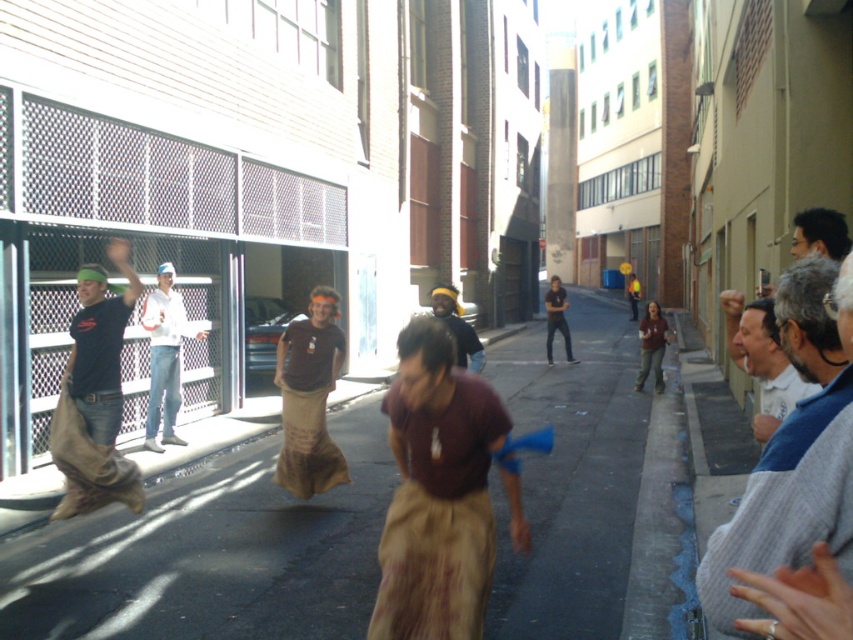
Measure the distance between white shirt at right and brown cotton shirt at center.

The distance of white shirt at right from brown cotton shirt at center is 34.60 feet.

Is point (807, 396) closer to viewer compared to point (659, 348)?

Yes, point (807, 396) is in front of point (659, 348).

Which is behind, point (743, 332) or point (635, 380)?

Point (635, 380)

This screenshot has height=640, width=853. Find the location of `white shirt at right`. white shirt at right is located at coordinates (762, 358).

Which is above, brown fabric sack at center or dark brown fabric pants at center?

dark brown fabric pants at center

Between point (312, 410) and point (433, 289), which one is positioned in front?

Positioned in front is point (312, 410).

Identify the location of brown fabric sack at center. This screenshot has height=640, width=853. (309, 397).

I want to click on white shirt at right, so click(762, 358).

How distant is white shirt at right from dark blue shirt at center?

They are 15.38 meters apart.

Does point (780, 420) come in front of point (572, 356)?

Yes, point (780, 420) is in front of point (572, 356).

Identify the location of white shirt at right. (762, 358).